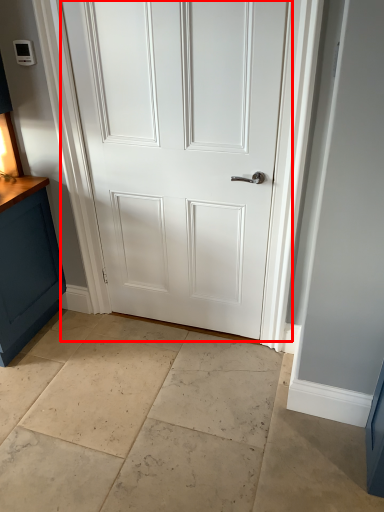
Question: From the image, what is the correct spatial relationship of door (annotated by the red box) in relation to concrete?

Choices:
 (A) left
 (B) right

Answer: (B)